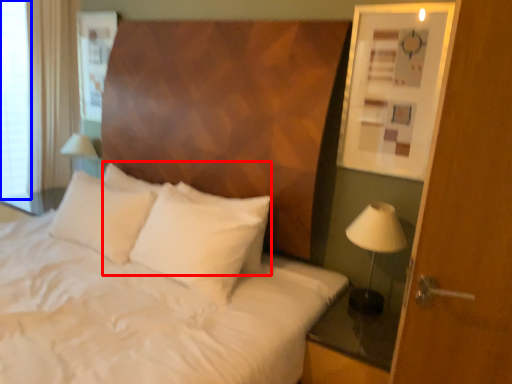
Question: Which of the following is the farthest to the observer, pillow (highlighted by a red box) or window screen (highlighted by a blue box)?

Choices:
 (A) pillow
 (B) window screen

Answer: (B)